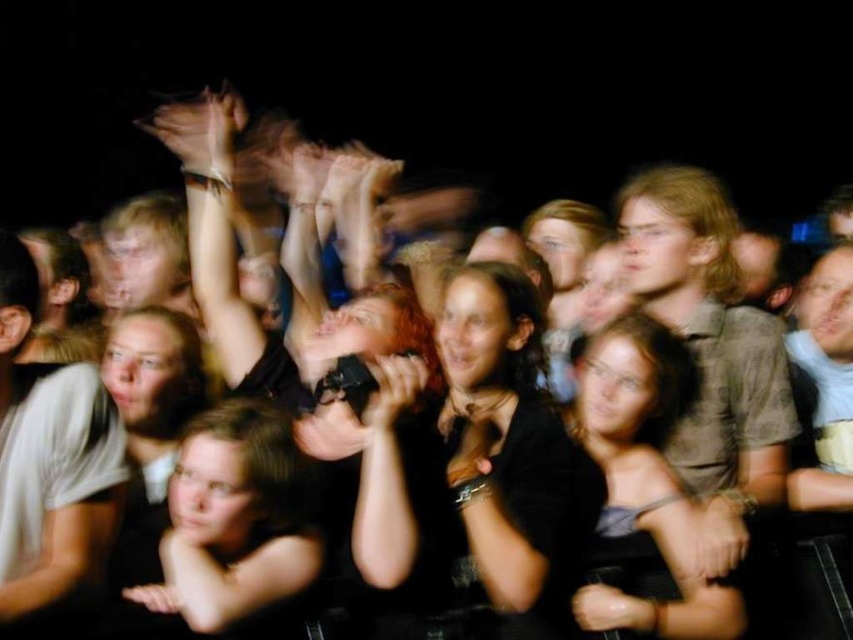
Between point (819, 282) and point (181, 134), which one is positioned in front?

Point (181, 134) is in front.

Does light brown hair at center appear under translucent skin hand at upper center?

Yes, light brown hair at center is below translucent skin hand at upper center.

Is point (795, 474) positioned in front of point (172, 113)?

That is True.

Identify the location of light brown hair at center. (825, 381).

Where is `black fabric shirt at center`? This screenshot has width=853, height=640. black fabric shirt at center is located at coordinates (50, 464).

Is black fabric shirt at center above black matte shirt at center?

Yes.

Where is `black fabric shirt at center`? The height and width of the screenshot is (640, 853). black fabric shirt at center is located at coordinates (50, 464).

I want to click on black fabric shirt at center, so click(50, 464).

Who is taller, black matte shirt at center or translucent skin hand at upper center?

black matte shirt at center is taller.

Describe the element at coordinates (234, 518) in the screenshot. I see `black matte shirt at center` at that location.

Locate an element on the screen. The image size is (853, 640). black matte shirt at center is located at coordinates (234, 518).